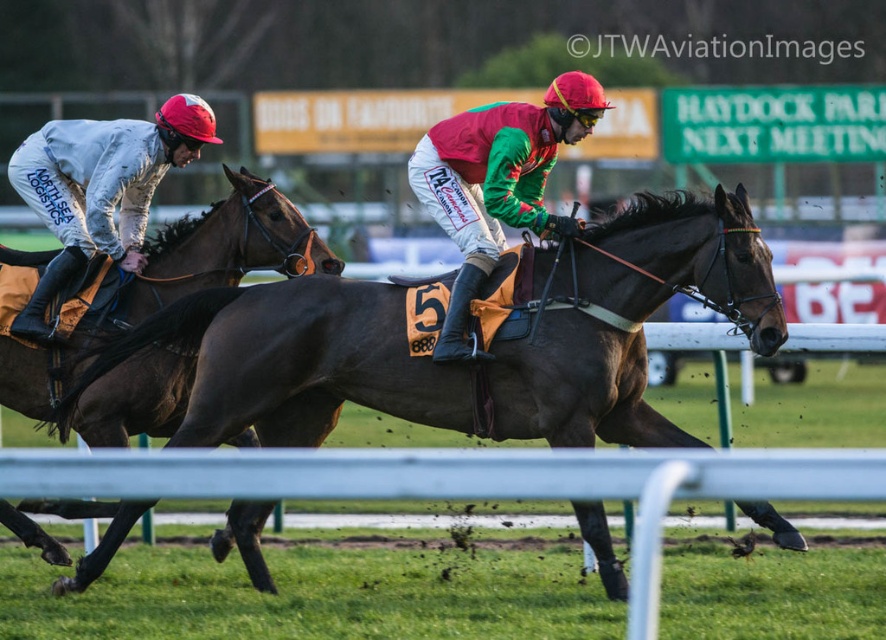
You are a race commentator observing the horse race at Haydock Park. You notice the green and red jersey at center and the matte white jockey suit at left. How far apart are these two jockeys?

The distance between the green and red jersey at center and the matte white jockey suit at left is 9.50 feet.

You are a spectator at the Haydock Park horse race and notice two jockeys in the foreground. The first is wearing a matte white jockey suit at left, and the second has a green and red jersey at center. From your vantage point, which jockey appears closer to the ground?

The green and red jersey at center is located below the matte white jockey suit at left, so the jockey in the green and red jersey at center appears closer to the ground.